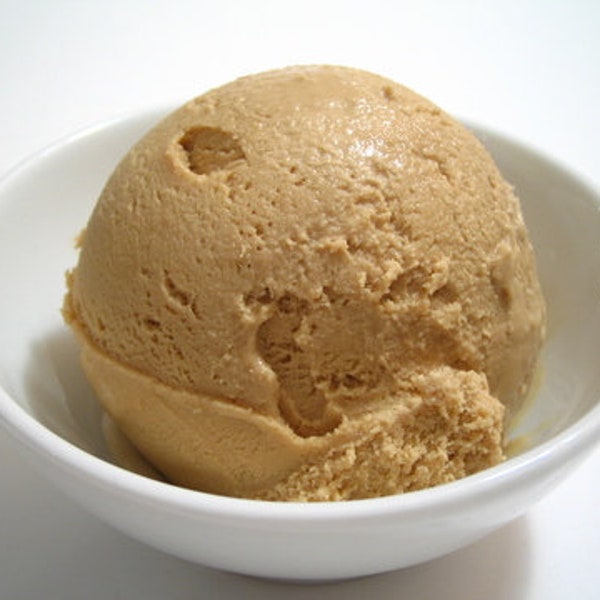
This screenshot has height=600, width=600. What are the coordinates of `gray shadow beneath bowl` in the screenshot? It's located at 466,575.